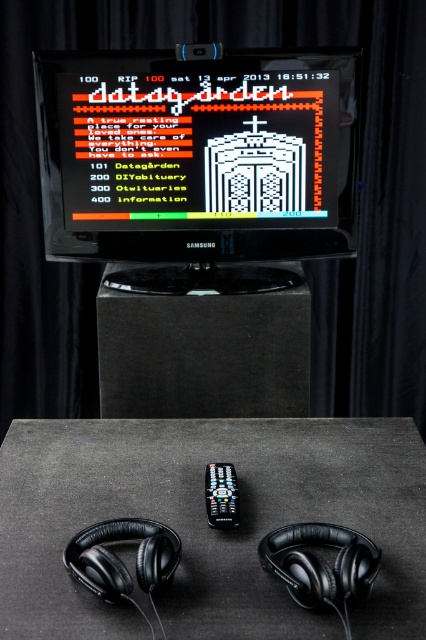
You are a visitor at an art exhibition and you want to listen to the audio guide provided by the black matte headphones at lower center while watching the digital artwork on the black glossy monitor at center. Can you do this simultaneously without moving either the headphones or the monitor?

The black matte headphones at lower center is behind the black glossy monitor at center, so you can listen to the audio guide and watch the digital artwork simultaneously without moving either device since the headphones are positioned behind the monitor and won

In the scene shown: You are setting up a presentation and need to place both the black matte table at center and the black matte headphones at lower center on a stage. The stage has limited space. Which object should you prioritize placing first if you want to ensure there is enough room for both?

The black matte table at center is bigger than the black matte headphones at lower center, so you should prioritize placing the black matte table at center first to ensure there is enough space for both objects.

You are setting up a home entertainment system and have both the black glossy monitor at center and the black matte headphones at lower center. Which device has a greater width?

The black glossy monitor at center has a greater width than the black matte headphones at lower center.